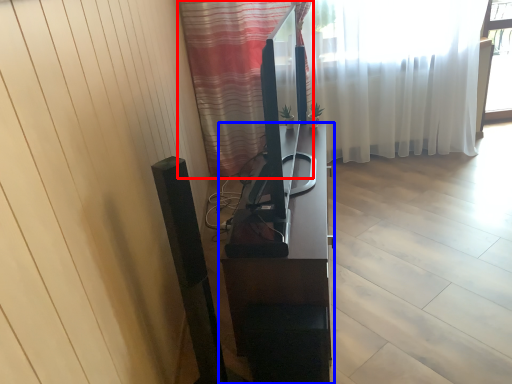
Question: Which point is closer to the camera, curtain (highlighted by a red box) or furniture (highlighted by a blue box)?

Choices:
 (A) curtain
 (B) furniture

Answer: (A)